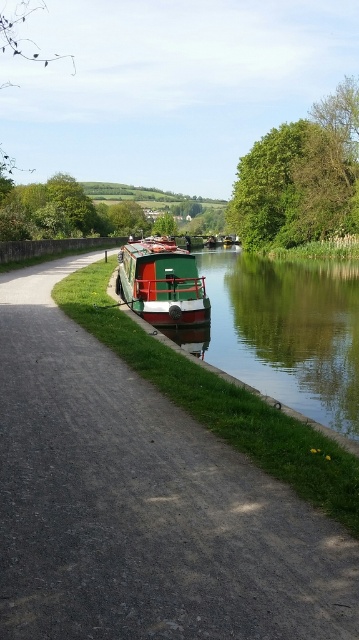
You are a photographer standing on the paved path and want to capture a photo of both the green matte boat at center and the green glossy boat at center. Which boat appears shorter in the photo?

The green matte boat at center appears shorter in the photo because it has a lesser height compared to the green glossy boat at center.

You are a photographer standing on the paved path and want to take a photo of the green polished wood barge at center and the green leafy tree at upper right. Which object will appear closer to the front of the photo?

The green leafy tree at upper right will appear closer to the front of the photo because the green polished wood barge at center is behind it.

Looking at this image, you are standing at the edge of the canal and want to take a photo that includes both point [98,484] and point [322,298]. Which point will appear larger in your photo?

Point [98,484] is closer to the camera than point [322,298], so it will appear larger in the photo.